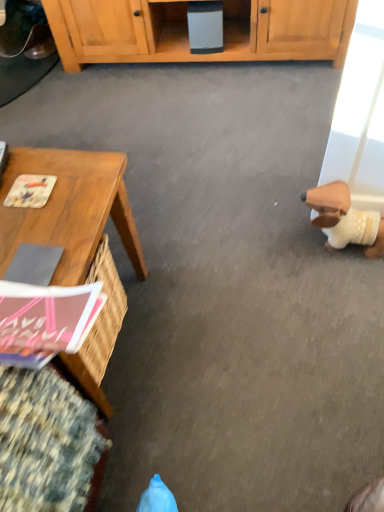
Question: Which is correct: printed paper magazine at left, which is the 2th magazine in bottom-to-top order, is inside brown plush toy at right, or outside of it?

Choices:
 (A) inside
 (B) outside

Answer: (B)

Question: In the image, is printed paper magazine at left, which appears as the 1th magazine when viewed from the top, on the left side or the right side of brown plush toy at right?

Choices:
 (A) left
 (B) right

Answer: (A)

Question: Based on their relative distances, which object is nearer to the pink matte magazine at lower left, the second magazine when ordered from back to front?

Choices:
 (A) wooden desk at left
 (B) brown plush toy at right
 (C) printed paper magazine at left, the 2th magazine viewed from the front

Answer: (A)

Question: Considering the real-world distances, which object is farthest from the pink matte magazine at lower left, which is the second magazine from top to bottom?

Choices:
 (A) wooden desk at left
 (B) printed paper magazine at left, which is the 2th magazine in bottom-to-top order
 (C) brown plush toy at right

Answer: (C)